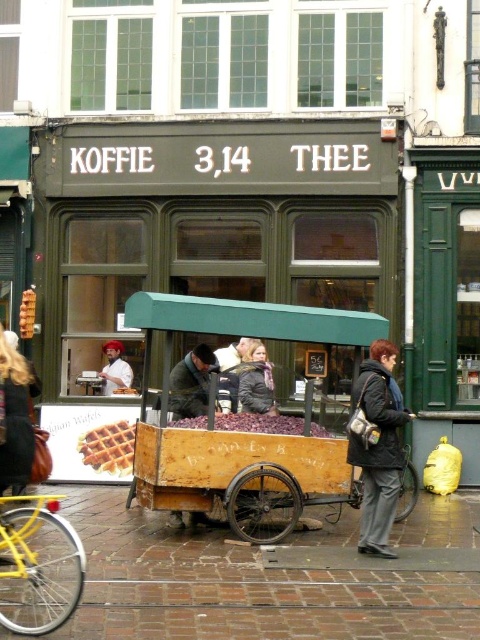
You are a delivery person standing on the brick pavement at lower center, and you need to place a package on the waffletexturedfood at center. Can you reach it without moving from your current position?

The brick pavement at lower center is 6.43 meters away from the waffletexturedfood at center. Since the distance is quite large, you cannot reach the waffletexturedfood at center from your current position without moving.

Looking at this image, you are a customer at the KOFFIE 3,14 THEE shop and want to buy the tallest item available. Which item should you choose between the golden waffle at center and the waffletexturedfood at center?

The golden waffle at center is taller than the waffletexturedfood at center, so you should choose the golden waffle at center.